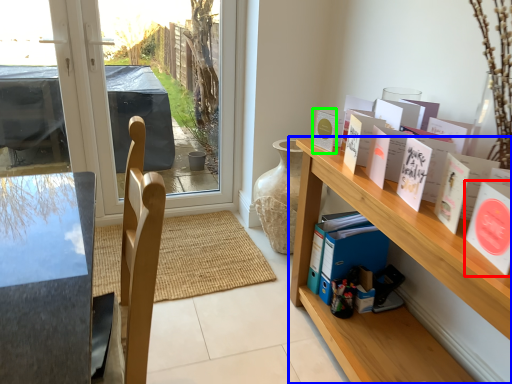
Question: Which is nearer to the book (highlighted by a red box)? shelf (highlighted by a blue box) or book (highlighted by a green box).

Choices:
 (A) shelf
 (B) book

Answer: (A)